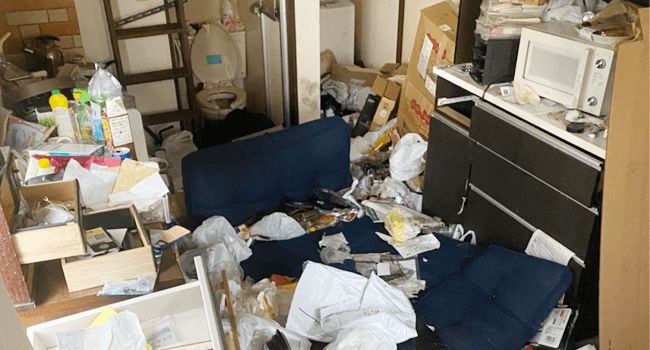
The image size is (650, 350). Identify the location of type of appliance. (49, 47).